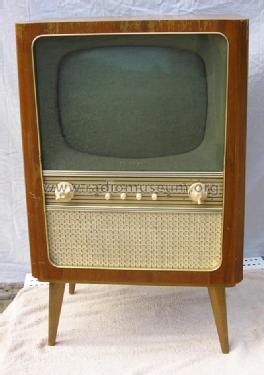
Where is `tv screen`? The image size is (264, 375). tv screen is located at coordinates (129, 109).